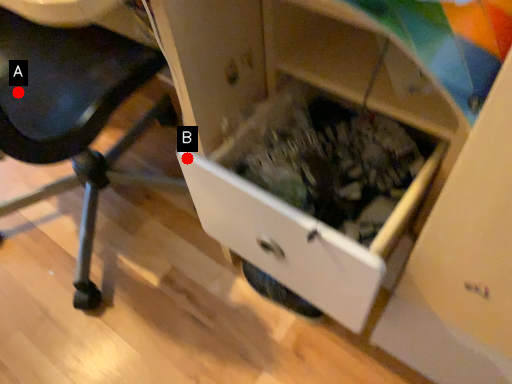
Question: Two points are circled on the image, labeled by A and B beside each circle. Which of the following is the closest to the observer?

Choices:
 (A) A is closer
 (B) B is closer

Answer: (B)